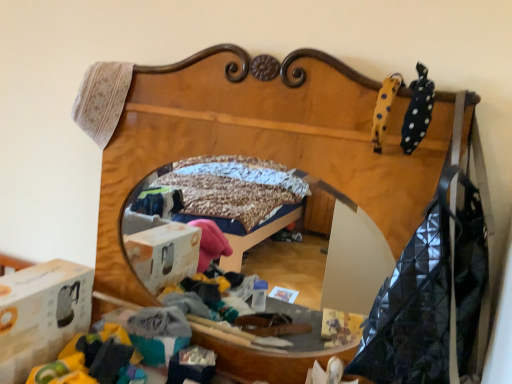
Where is `empty space that is ontop of white cardboard box at lower left (from a real-world perspective)`? empty space that is ontop of white cardboard box at lower left (from a real-world perspective) is located at coordinates (35, 277).